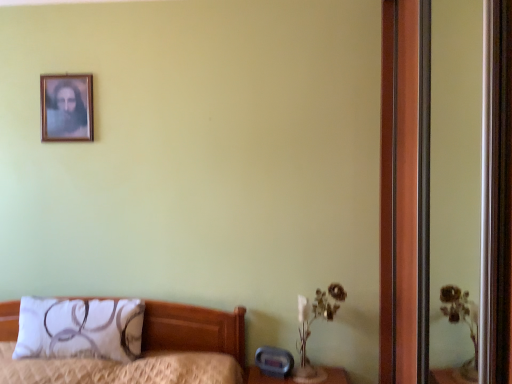
Question: Is wooden screen door at right to the left of wooden picture frame at upper left from the viewer's perspective?

Choices:
 (A) no
 (B) yes

Answer: (A)

Question: Does wooden screen door at right have a greater width compared to wooden picture frame at upper left?

Choices:
 (A) no
 (B) yes

Answer: (B)

Question: Considering the relative sizes of wooden screen door at right and wooden picture frame at upper left in the image provided, is wooden screen door at right taller than wooden picture frame at upper left?

Choices:
 (A) yes
 (B) no

Answer: (A)

Question: Could you tell me if wooden screen door at right is facing wooden picture frame at upper left?

Choices:
 (A) yes
 (B) no

Answer: (A)

Question: Is wooden screen door at right positioned in front of wooden picture frame at upper left?

Choices:
 (A) yes
 (B) no

Answer: (A)

Question: Based on their sizes in the image, would you say white fabric pillow at lower left is bigger or smaller than wooden picture frame at upper left?

Choices:
 (A) big
 (B) small

Answer: (A)

Question: Looking at their shapes, would you say white fabric pillow at lower left is wider or thinner than wooden picture frame at upper left?

Choices:
 (A) wide
 (B) thin

Answer: (A)

Question: Is white fabric pillow at lower left in front of or behind wooden picture frame at upper left in the image?

Choices:
 (A) behind
 (B) front

Answer: (B)

Question: Would you say white fabric pillow at lower left is inside or outside wooden picture frame at upper left?

Choices:
 (A) inside
 (B) outside

Answer: (B)

Question: Choose the correct answer: Is white fabric pillow at lower left inside wooden screen door at right or outside it?

Choices:
 (A) inside
 (B) outside

Answer: (B)

Question: Based on their sizes in the image, would you say white fabric pillow at lower left is bigger or smaller than wooden screen door at right?

Choices:
 (A) small
 (B) big

Answer: (A)

Question: Considering the positions of white fabric pillow at lower left and wooden screen door at right in the image, is white fabric pillow at lower left wider or thinner than wooden screen door at right?

Choices:
 (A) thin
 (B) wide

Answer: (B)

Question: Based on their positions, is white fabric pillow at lower left located to the left or right of wooden screen door at right?

Choices:
 (A) right
 (B) left

Answer: (B)

Question: Choose the correct answer: Is wooden picture frame at upper left inside wooden screen door at right or outside it?

Choices:
 (A) inside
 (B) outside

Answer: (B)

Question: Is wooden picture frame at upper left taller or shorter than wooden screen door at right?

Choices:
 (A) short
 (B) tall

Answer: (A)